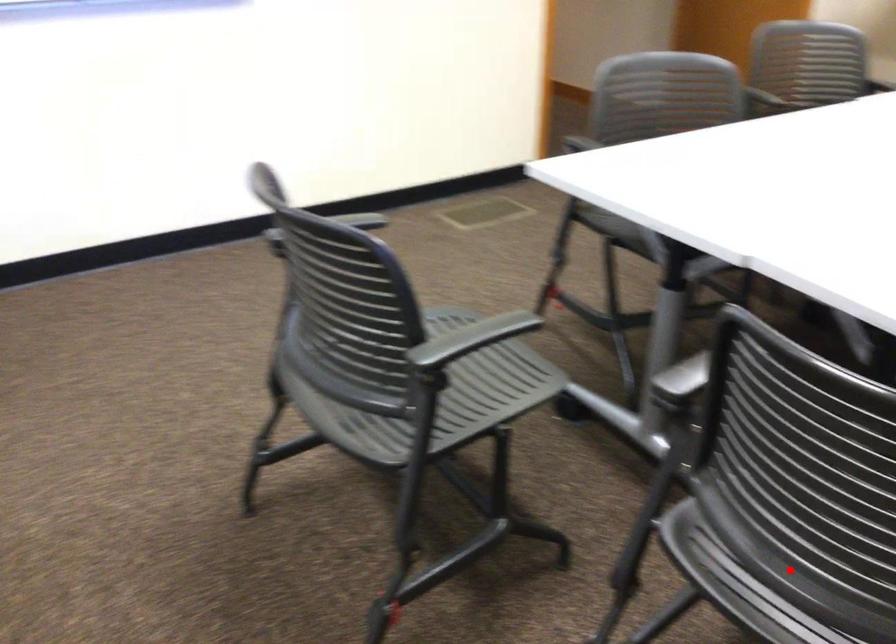
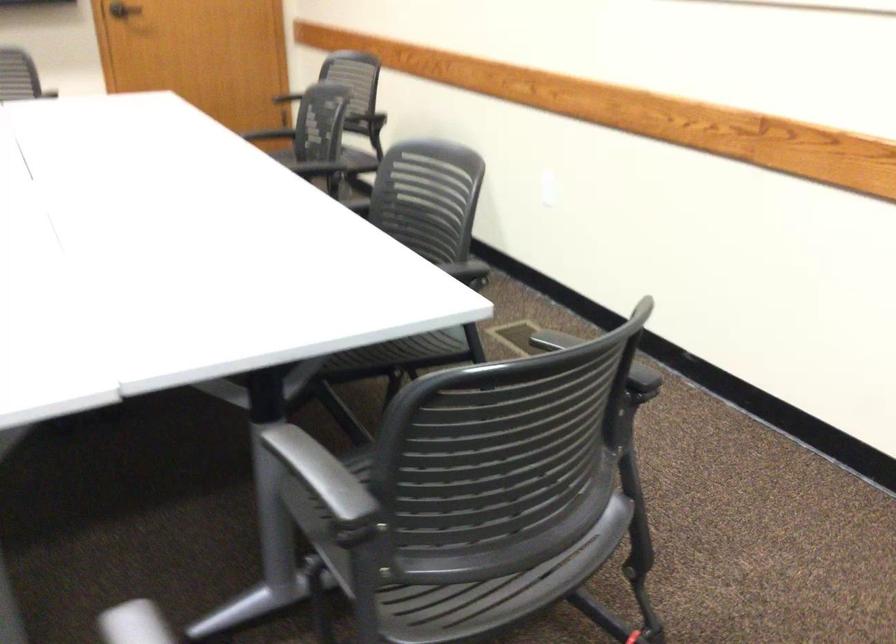
Find the pixel in the second image that matches the highlighted location in the first image.

(496, 590)